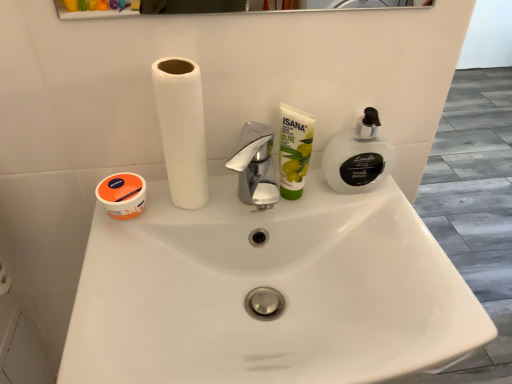
Where is `vacant area that is in front of white translucent pump at right`? This screenshot has height=384, width=512. vacant area that is in front of white translucent pump at right is located at coordinates 406,262.